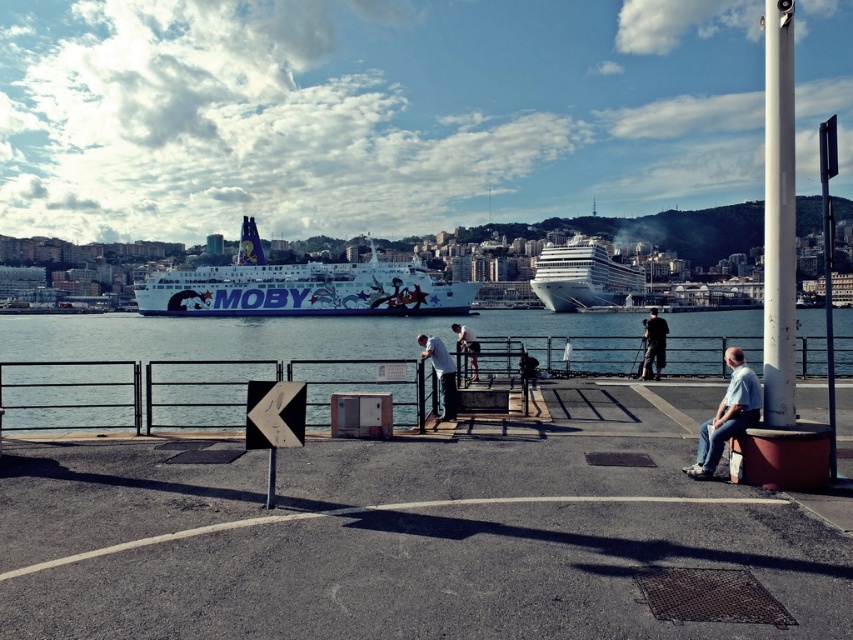
Question: Is white glossy ferry at center positioned before white matte shirt at center?

Choices:
 (A) no
 (B) yes

Answer: (A)

Question: Which of the following is the closest to the observer?

Choices:
 (A) white matte shirt at center
 (B) clear blue water at center
 (C) white glossy cruise ship at center
 (D) white glossy ferry at center

Answer: (A)

Question: Is clear blue water at center in front of white matte shirt at center?

Choices:
 (A) yes
 (B) no

Answer: (B)

Question: Which point appears farthest from the camera in this image?

Choices:
 (A) (653, 330)
 (B) (264, 282)
 (C) (36, 344)

Answer: (B)

Question: Is white glossy ferry at center smaller than light blue jeans at center?

Choices:
 (A) yes
 (B) no

Answer: (B)

Question: Based on their relative distances, which object is farther from the white glossy ferry at center?

Choices:
 (A) white matte shirt at center
 (B) clear blue water at center

Answer: (A)